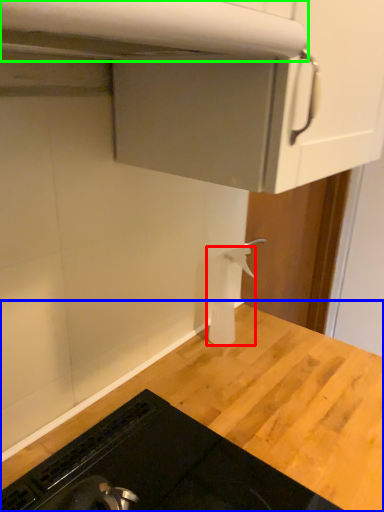
Question: Which is nearer to the toilet paper (highlighted by a red box)? countertop (highlighted by a blue box) or exhaust hood (highlighted by a green box).

Choices:
 (A) countertop
 (B) exhaust hood

Answer: (A)